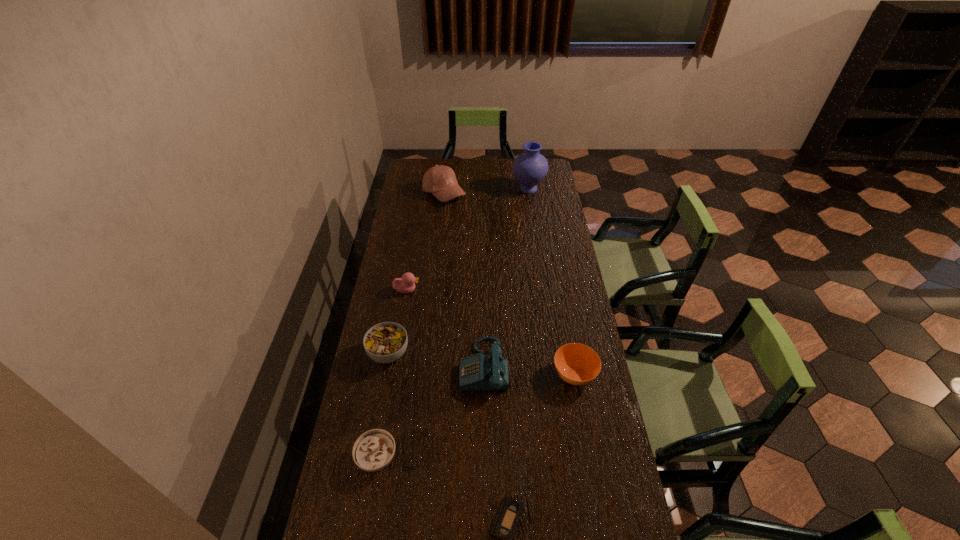
This screenshot has height=540, width=960. In order to click on empty location between the nearest soup bowl and the third farthest object in this screenshot , I will do `click(392, 374)`.

Locate an element on the screen. The width and height of the screenshot is (960, 540). free space between the vase and the seventh tallest object is located at coordinates (453, 323).

Where is `vacant region between the sixth nearest object and the seventh tallest object`? Image resolution: width=960 pixels, height=540 pixels. vacant region between the sixth nearest object and the seventh tallest object is located at coordinates (392, 374).

You are a GUI agent. You are given a task and a screenshot of the screen. Output one action in this format:
    pyautogui.click(x=<x>, y=<y>)
    Task: Click on the vacant region between the seventh farthest object and the rightmost soup bowl
    The image size is (960, 540).
    Given the screenshot: What is the action you would take?
    pyautogui.click(x=475, y=416)

The height and width of the screenshot is (540, 960). I want to click on object identified as the closest to the nearest object, so click(x=373, y=450).

Locate which object ranks fourth in proximity to the vase. Please provide its 2D coordinates. Your answer should be formatted as a tuple, i.e. [(x, y)], where the tuple contains the x and y coordinates of a point satisfying the conditions above.

[(577, 364)]

The height and width of the screenshot is (540, 960). Find the location of `soup bowl that is the closest to the rightmost soup bowl`. soup bowl that is the closest to the rightmost soup bowl is located at coordinates (386, 342).

Where is `the second closest soup bowl to the telephone`? The width and height of the screenshot is (960, 540). the second closest soup bowl to the telephone is located at coordinates (386, 342).

Find the location of a particular element. This screenshot has width=960, height=540. vacant space that satisfies the following two spatial constraints: 1. on the back side of the tallest object; 2. on the left side of the seventh farthest object is located at coordinates (422, 189).